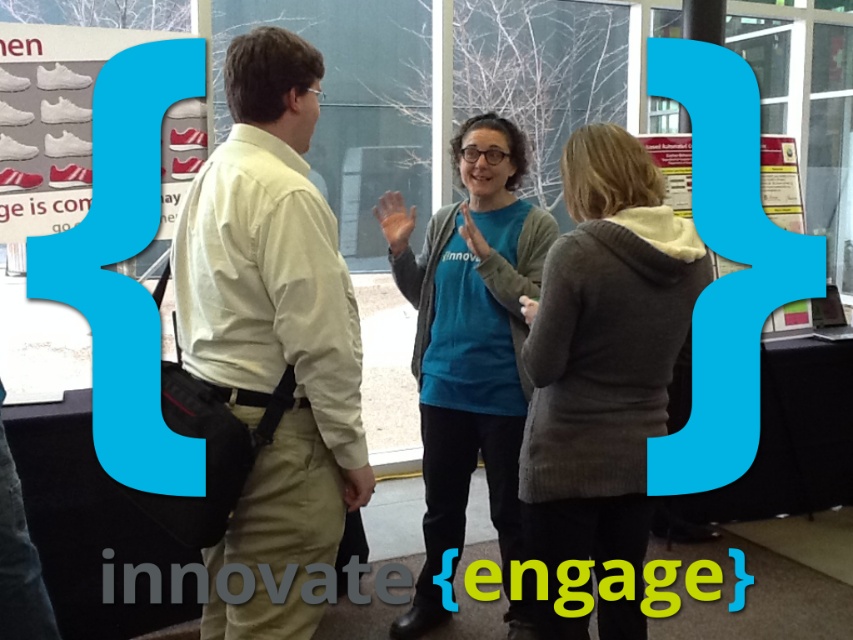
Question: Does gray knit sweater at center come in front of blue cotton shirt at center?

Choices:
 (A) yes
 (B) no

Answer: (A)

Question: Which object is farther from the camera taking this photo?

Choices:
 (A) light beige shirt at center
 (B) blue cotton shirt at center

Answer: (B)

Question: Can you confirm if gray knit sweater at center is smaller than blue cotton shirt at center?

Choices:
 (A) no
 (B) yes

Answer: (B)

Question: Which point is farther to the camera?

Choices:
 (A) (618, 177)
 (B) (308, 387)

Answer: (A)

Question: Can you confirm if light beige shirt at center is positioned above blue cotton shirt at center?

Choices:
 (A) yes
 (B) no

Answer: (A)

Question: Which point is closer to the camera taking this photo?

Choices:
 (A) (613, 630)
 (B) (502, 356)
 (C) (271, 460)

Answer: (C)